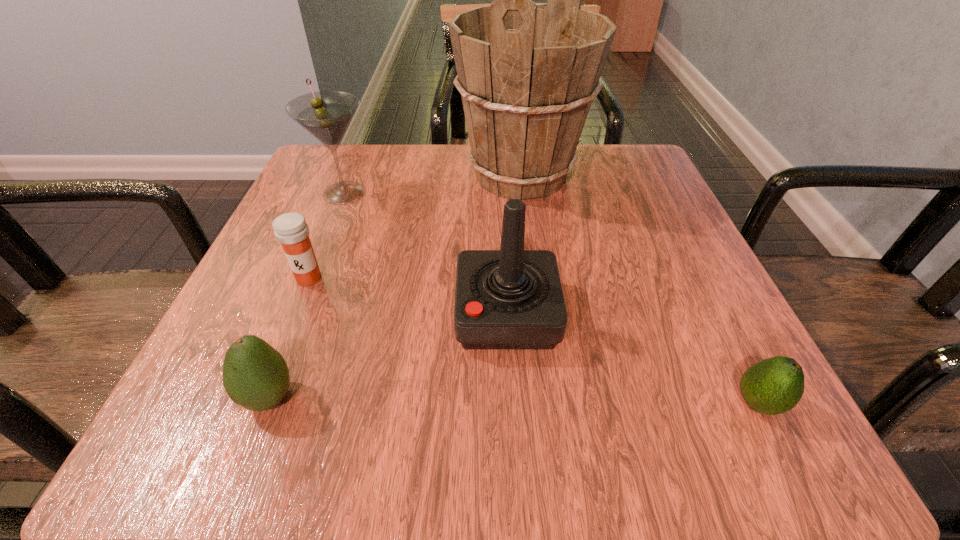
Find the location of `bucket`. bucket is located at coordinates (527, 73).

Where is `martini`? This screenshot has height=540, width=960. martini is located at coordinates (326, 115).

This screenshot has width=960, height=540. I want to click on joystick, so click(x=511, y=298).

Identify the location of medicine. This screenshot has width=960, height=540. (291, 230).

You are a GUI agent. You are given a task and a screenshot of the screen. Output one action in this format:
    pyautogui.click(x=<x>, y=<y>)
    Task: Click on the taller avocado
    
    Given the screenshot: What is the action you would take?
    pyautogui.click(x=255, y=376)

Where is `the shorter avocado`? The height and width of the screenshot is (540, 960). the shorter avocado is located at coordinates (775, 385).

Image resolution: width=960 pixels, height=540 pixels. Find the location of `the rightmost object`. the rightmost object is located at coordinates (775, 385).

You are a GUI agent. You are given a task and a screenshot of the screen. Output one action in this format:
    pyautogui.click(x=<x>, y=<y>)
    Task: Click on the free space located on the left of the tallest object
    The image size is (960, 540).
    Given the screenshot: What is the action you would take?
    pyautogui.click(x=306, y=176)

At what (x,y) coordinates should I click in order to perform the action: click on vacant space located on the back of the martini. Please return your answer as a coordinate pair (x, y). Image resolution: width=960 pixels, height=540 pixels. Looking at the image, I should click on (364, 145).

Locate an element on the screen. free space located 0.140m on the front-facing side of the joystick is located at coordinates (362, 314).